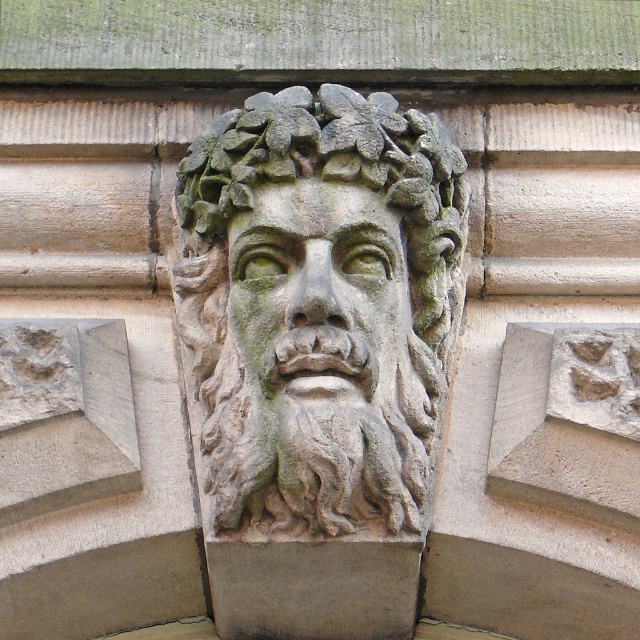
Question: Which point is closer to the camera?

Choices:
 (A) green mossy stone face at center
 (B) green stone face at center

Answer: (A)

Question: Which point is closer to the camera?

Choices:
 (A) green mossy stone face at center
 (B) green stone face at center

Answer: (A)

Question: Which object appears closest to the camera in this image?

Choices:
 (A) green mossy stone face at center
 (B) green stone face at center

Answer: (A)

Question: Can you confirm if green mossy stone face at center is wider than green stone face at center?

Choices:
 (A) yes
 (B) no

Answer: (A)

Question: Is green mossy stone face at center above green stone face at center?

Choices:
 (A) yes
 (B) no

Answer: (A)

Question: Does green mossy stone face at center have a greater width compared to green stone face at center?

Choices:
 (A) yes
 (B) no

Answer: (A)